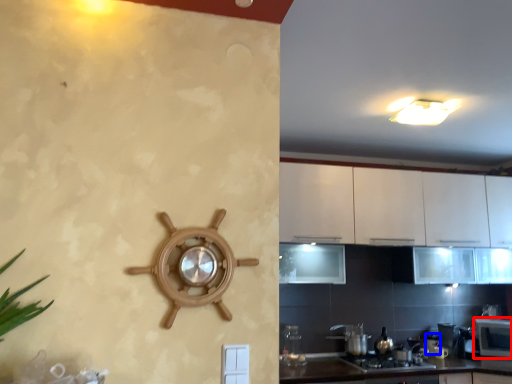
Question: Which point is further to the camera, microwave (highlighted by a red box) or appliance (highlighted by a blue box)?

Choices:
 (A) microwave
 (B) appliance

Answer: (B)